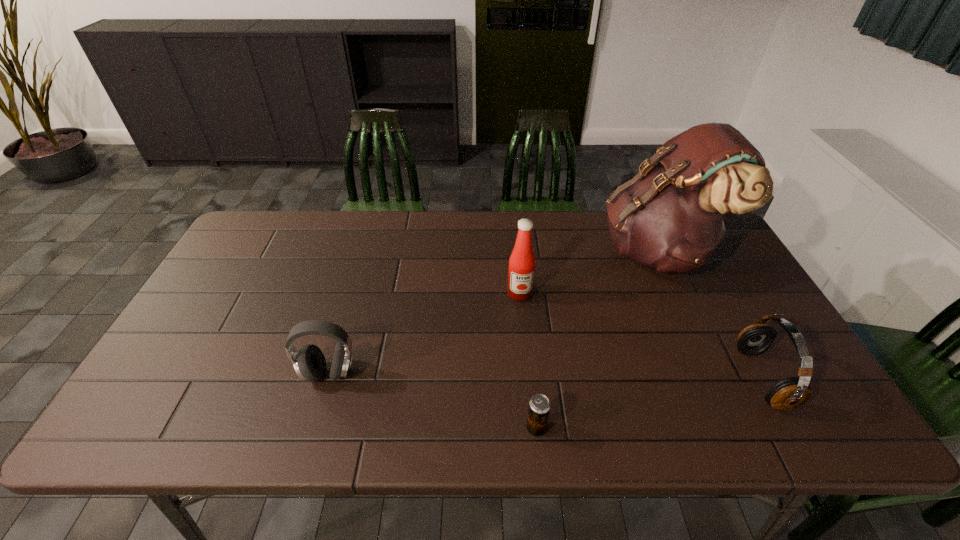
Identify the location of the tallest object. (671, 216).

Image resolution: width=960 pixels, height=540 pixels. What are the coordinates of `condiment` in the screenshot? It's located at (522, 261).

Find the location of a particular element. This screenshot has height=540, width=960. the left headset is located at coordinates (309, 362).

At what (x,y) coordinates should I click in order to perform the action: click on the right headset. Please return your answer as a coordinate pair (x, y). The width and height of the screenshot is (960, 540). Looking at the image, I should click on (788, 393).

Where is `beer can`? beer can is located at coordinates (539, 406).

This screenshot has height=540, width=960. Find the location of `the nearest object`. the nearest object is located at coordinates (539, 406).

Locate an element on the screen. The image size is (960, 540). vacant space positioned 0.250m at the front of the satchel with buckles is located at coordinates (522, 251).

You are a GUI agent. You are given a task and a screenshot of the screen. Output one action in this format:
    pyautogui.click(x=<x>, y=<y>)
    Task: Click on the vacant region located 0.180m at the front of the satchel with buckles
    The height and width of the screenshot is (540, 960).
    Given the screenshot: What is the action you would take?
    pyautogui.click(x=544, y=251)

You are a GUI agent. You are given a task and a screenshot of the screen. Output one action in this format:
    pyautogui.click(x=<x>, y=<y>)
    Task: Click on the blank space located 0.270m at the front of the satchel with buckles
    This screenshot has height=540, width=960.
    Given the screenshot: What is the action you would take?
    pyautogui.click(x=516, y=251)

This screenshot has height=540, width=960. Identify the location of free space located 0.350m on the front-facing side of the condiment. (531, 416).